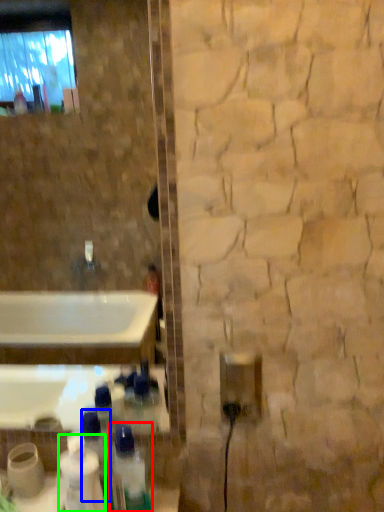
Question: Estimate the real-world distances between objects in this image. Which object is closer to bottle (highlighted by a red box), bottle (highlighted by a blue box) or cleaning product (highlighted by a green box)?

Choices:
 (A) bottle
 (B) cleaning product

Answer: (A)